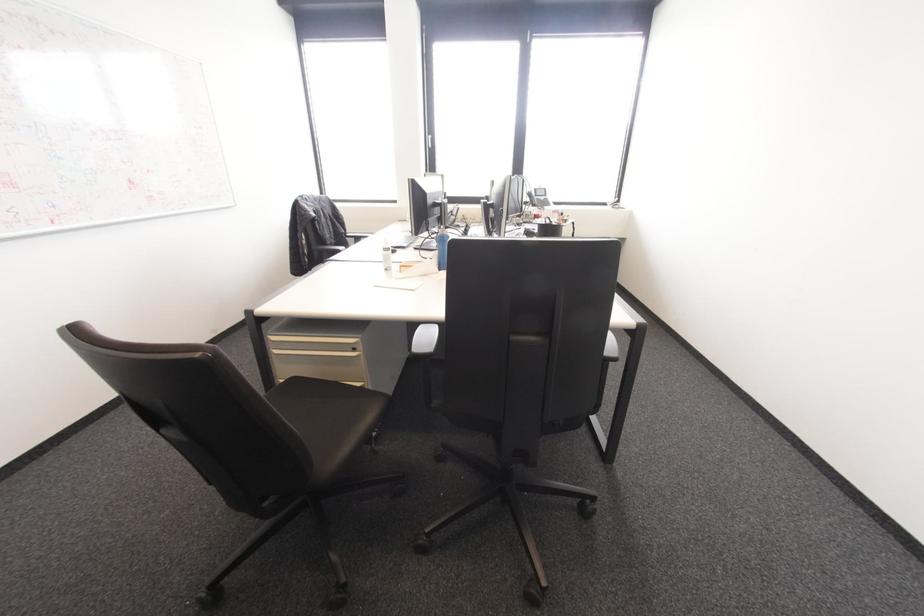
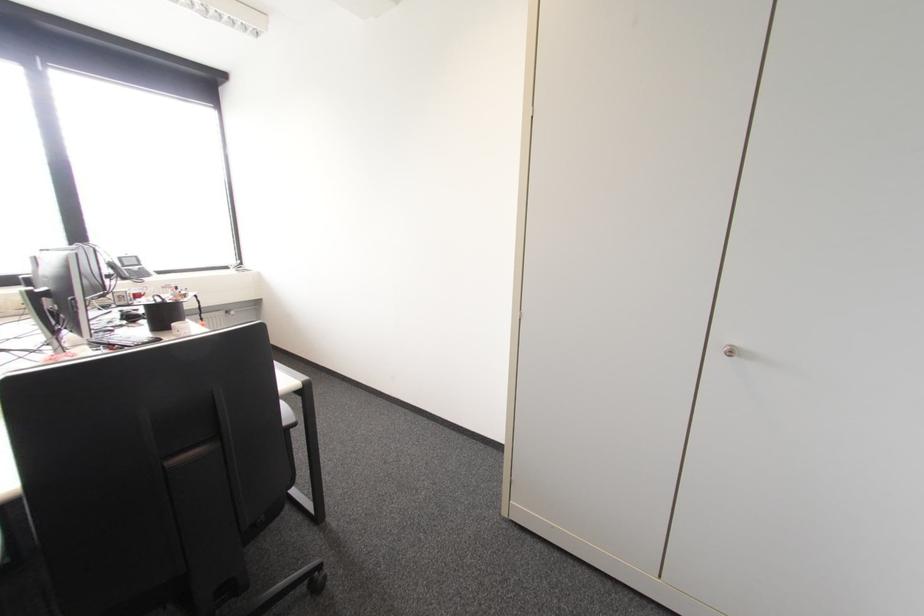
In the second image, find the point that corresponds to point 540,225 in the first image.

(148, 306)